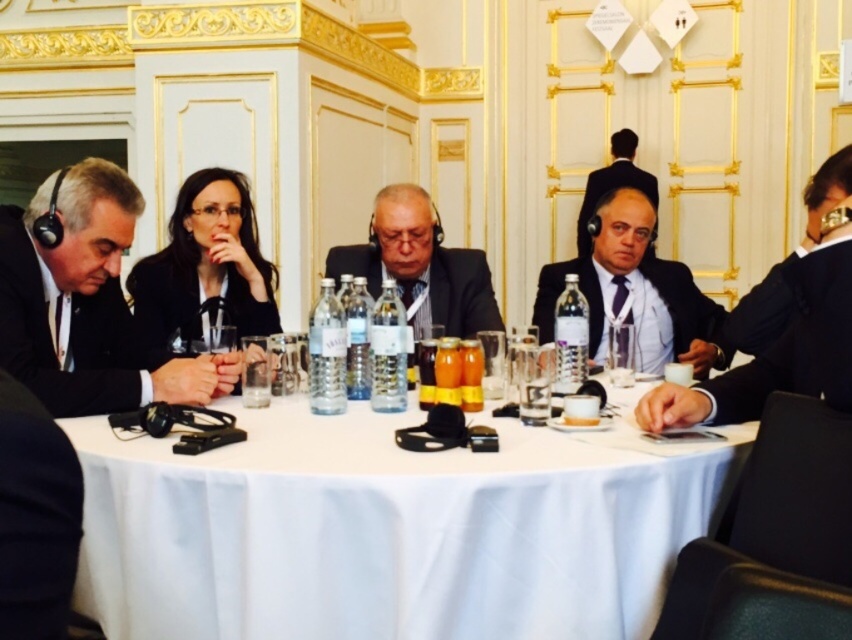
Which of these two, white cloth at center or dark gray suit at center, stands shorter?

dark gray suit at center

Is point (258, 614) farther from camera compared to point (462, 316)?

No, it is in front of (462, 316).

Does point (343, 605) lie in front of point (475, 310)?

Yes, it is in front of point (475, 310).

The width and height of the screenshot is (852, 640). I want to click on white cloth at center, so click(x=386, y=529).

Who is more distant from viewer, (107, 396) or (722, 365)?

Point (722, 365)

Who is shorter, black matte suit at left or matte black suit at center?

matte black suit at center is shorter.

Between point (14, 216) and point (703, 376), which one is positioned in front?

Point (14, 216) is more forward.

You are a GUI agent. You are given a task and a screenshot of the screen. Output one action in this format:
    pyautogui.click(x=<x>, y=<y>)
    Task: Click on the black matte suit at left
    Image resolution: width=852 pixels, height=640 pixels.
    Given the screenshot: What is the action you would take?
    pyautogui.click(x=65, y=333)

Can you confirm if white cloth at center is wider than black matte suit at left?

Yes.

Who is lower down, white cloth at center or black matte suit at left?

white cloth at center

Between point (655, 586) and point (68, 328), which one is positioned behind?

The point (68, 328) is more distant.

This screenshot has width=852, height=640. Find the location of `white cloth at center`. white cloth at center is located at coordinates (386, 529).